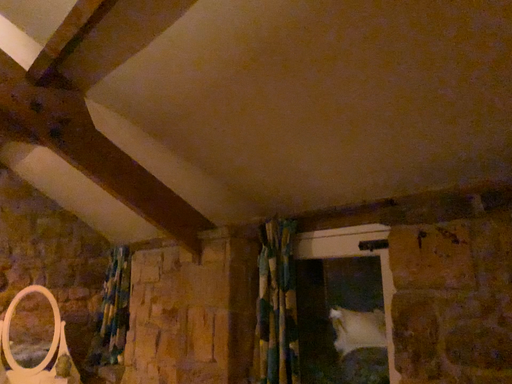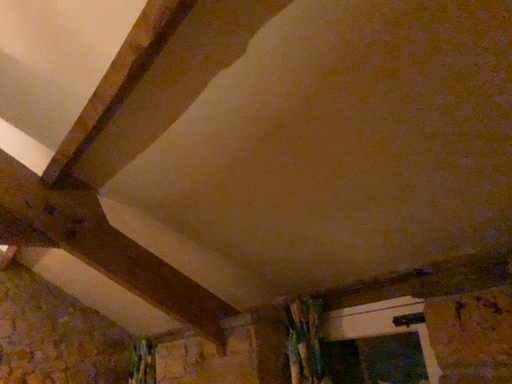
Question: How did the camera likely rotate when shooting the video?

Choices:
 (A) rotated upward
 (B) rotated downward

Answer: (A)